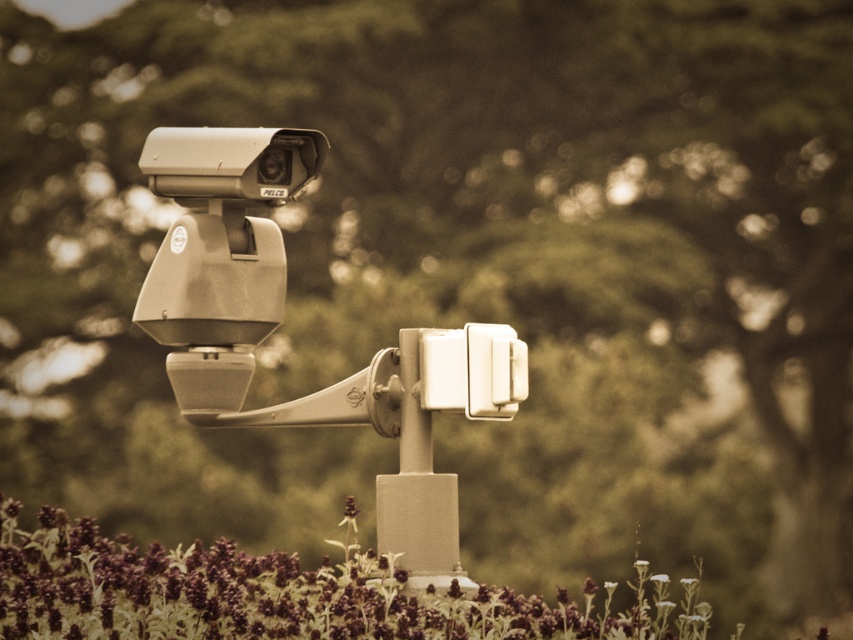
Which is in front, point (271, 243) or point (398, 502)?

Point (398, 502)

This screenshot has height=640, width=853. Describe the element at coordinates (281, 317) in the screenshot. I see `matte gray security camera at center` at that location.

Locate an element on the screen. Image resolution: width=853 pixels, height=640 pixels. matte gray security camera at center is located at coordinates coord(281,317).

Is purple matte flowers at lower center to the left of metallic pole at center from the viewer's perspective?

Indeed, purple matte flowers at lower center is positioned on the left side of metallic pole at center.

Is purple matte flowers at lower center smaller than metallic pole at center?

Incorrect, purple matte flowers at lower center is not smaller in size than metallic pole at center.

Which is in front, point (682, 632) or point (427, 506)?

Point (682, 632)

Find the location of a particular element. This screenshot has width=853, height=640. purple matte flowers at lower center is located at coordinates (283, 593).

Is point (376, 540) less distant than point (364, 625)?

That is False.

Is matte gray security camera at center further to camera compared to purple matte flowers at lower center?

Yes, matte gray security camera at center is further from the viewer.

Is point (480, 353) farther from camera compared to point (535, 602)?

That is False.

I want to click on matte gray security camera at center, so click(281, 317).